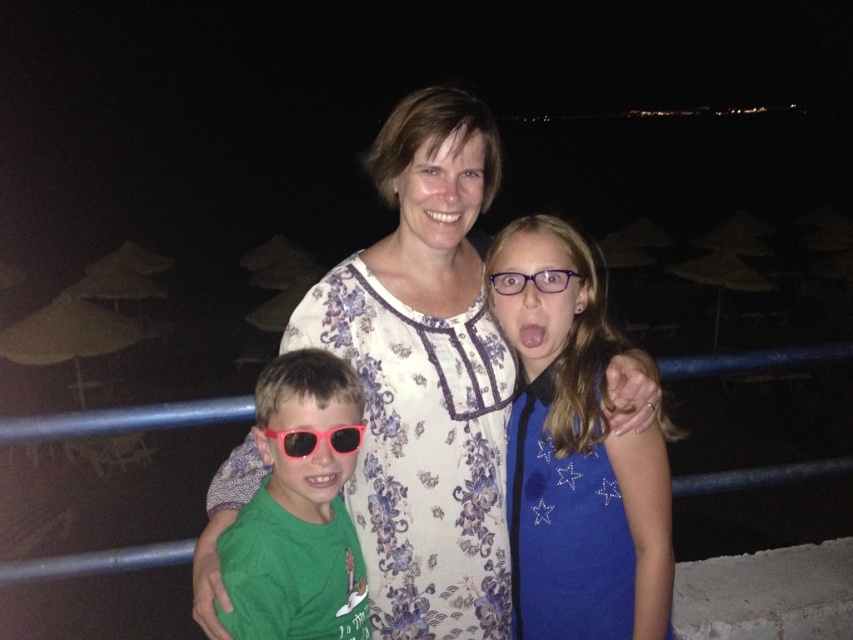
Question: Does floral cotton dress at center have a greater width compared to green matte shirt at lower left?

Choices:
 (A) yes
 (B) no

Answer: (A)

Question: Does white floral dress at center appear on the right side of green matte shirt at lower left?

Choices:
 (A) yes
 (B) no

Answer: (A)

Question: Which object is the closest to the pink plastic goggles at lower left?

Choices:
 (A) white floral dress at center
 (B) green matte shirt at lower left
 (C) floral cotton dress at center

Answer: (B)

Question: Among these points, which one is farthest from the camera?

Choices:
 (A) (305, 452)
 (B) (369, 371)
 (C) (573, 241)
 (D) (616, 419)

Answer: (B)

Question: Which of the following is the farthest from the observer?

Choices:
 (A) white floral dress at center
 (B) floral cotton dress at center

Answer: (B)

Question: Does white floral dress at center have a smaller size compared to floral cotton dress at center?

Choices:
 (A) yes
 (B) no

Answer: (B)